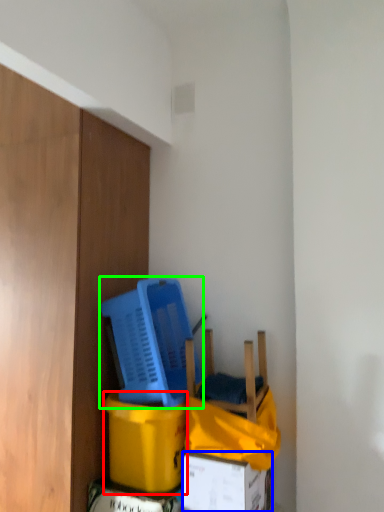
Question: Based on their relative distances, which object is farther from cardboard box (highlighted by a red box)? Choose from box (highlighted by a blue box) and basket (highlighted by a green box).

Choices:
 (A) box
 (B) basket

Answer: (B)